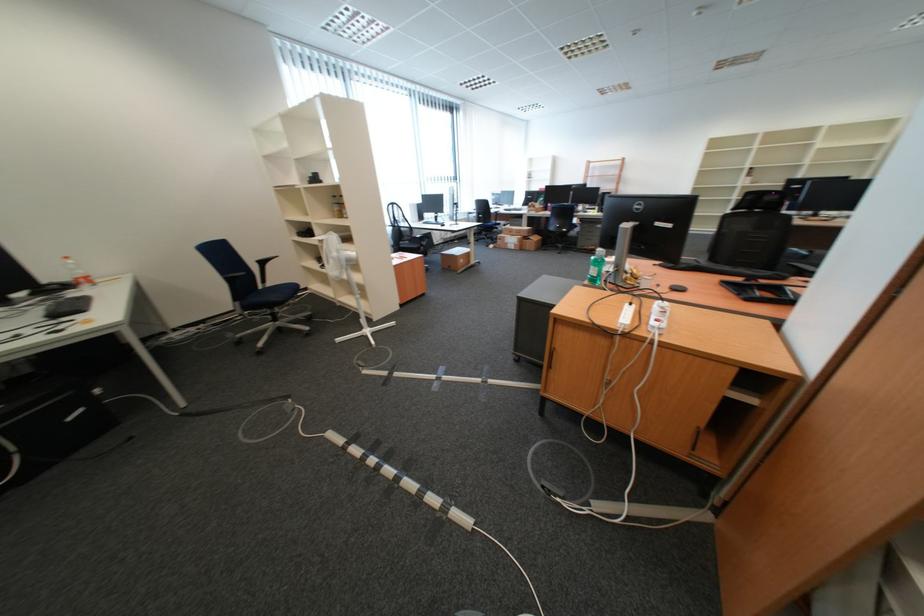
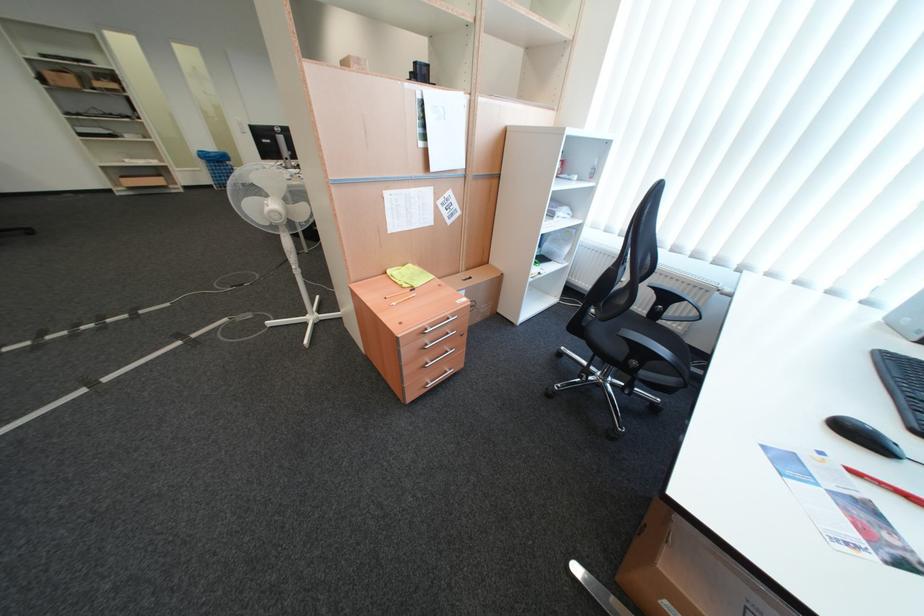
Locate, in the second image, the point that corresponds to pixel 455 227 in the first image.

(864, 434)